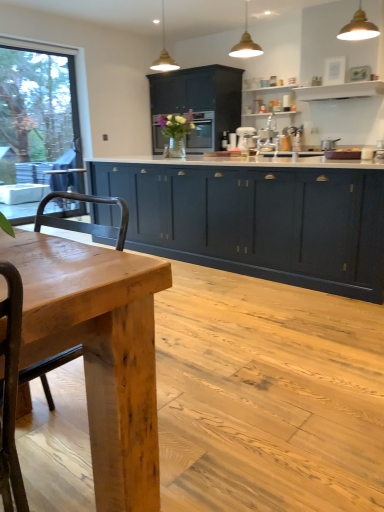
Question: In the image, is metallic gold pendant light at upper center, marked as the 3th light fixture in a back-to-front arrangement, on the left side or the right side of gold metallic pendant light at upper center, the third light fixture positioned from the front?

Choices:
 (A) right
 (B) left

Answer: (A)

Question: Considering the positions of point (359, 37) and point (165, 67), is point (359, 37) closer or farther from the camera than point (165, 67)?

Choices:
 (A) closer
 (B) farther

Answer: (A)

Question: Estimate the real-world distances between objects in this image. Which object is farther from the white glossy exhaust hood at upper center?

Choices:
 (A) matte dark blue cabinet at center, which is the 2th cabinetry in front-to-back order
 (B) gold metallic pendant light at upper center, the third light fixture in the right-to-left sequence
 (C) metallic gold pendant light at upper center, marked as the 3th light fixture in a back-to-front arrangement
 (D) satin silver coffee machine at center
 (E) natural wood table at center

Answer: (E)

Question: Which is farther from the matte black oven at center?

Choices:
 (A) satin silver coffee machine at center
 (B) gold metallic pendant light at upper center, the 1th light fixture positioned from the left
 (C) matte gold pendant light at upper center, the second light fixture positioned from the front
 (D) translucent glass vase at center
 (E) metallic gold pendant light at upper center, the 3th light fixture positioned from the left

Answer: (B)